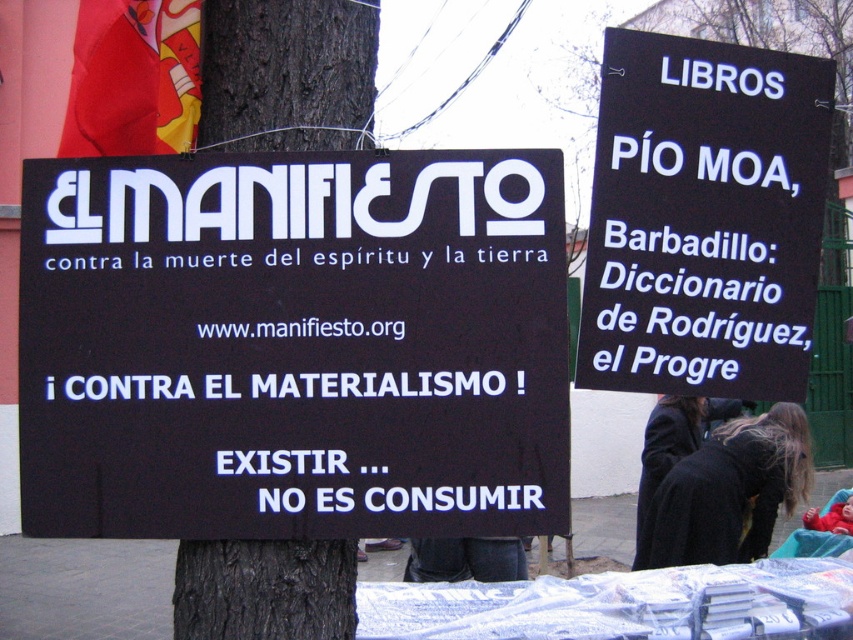
You are a photographer standing at the center of the image. You want to take a photo of the black wool coat at lower right. Which direction should you move to get a better shot?

Since the black wool coat at lower right is located at point (729, 492), you should move to the lower right direction to get a better shot of it.

In the scene shown: You are a photographer taking a picture of the two signs. You notice two points marked on the image at coordinates point (784, 408) and point (498, 572). Which point is closer to your camera?

Point (498, 572) is closer to the camera because it is less further than point (784, 408).

You are a photographer trying to capture both the black paper sign at upper right and the black wool coat at lower right in a single frame. Based on their sizes, which object should you focus on first to ensure both are in the frame?

The black paper sign at upper right has a smaller size compared to the black wool coat at lower right. To ensure both are in the frame, focus on positioning the larger object, the black wool coat at lower right, first since it requires more space, then adjust the camera angle to include the smaller sign.